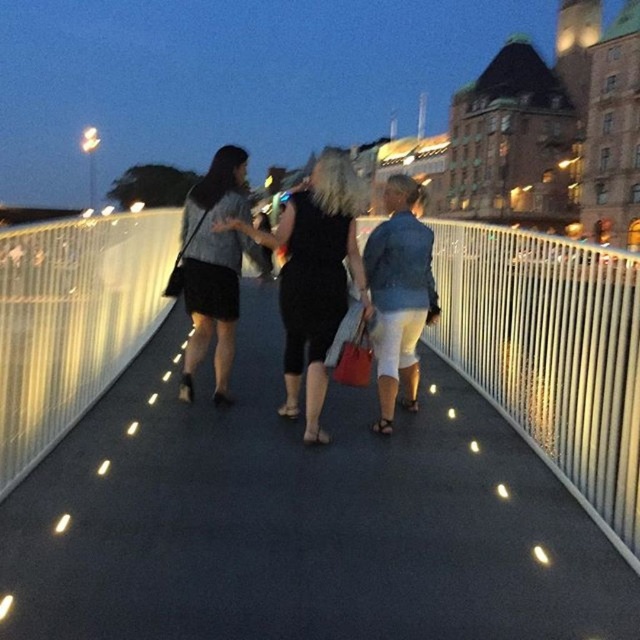
Question: Does black matte dress at center lie in front of matte black dress at center?

Choices:
 (A) yes
 (B) no

Answer: (A)

Question: Is black matte dress at center to the right of matte black dress at center from the viewer's perspective?

Choices:
 (A) no
 (B) yes

Answer: (B)

Question: Does black matte dress at center appear under matte black dress at center?

Choices:
 (A) yes
 (B) no

Answer: (B)

Question: Which point appears farthest from the camera in this image?

Choices:
 (A) (244, 230)
 (B) (173, 273)

Answer: (B)

Question: Which point is closer to the camera?

Choices:
 (A) (212, 268)
 (B) (307, 436)

Answer: (B)

Question: Among these objects, which one is farthest from the camera?

Choices:
 (A) black matte dress at center
 (B) matte black dress at center

Answer: (B)